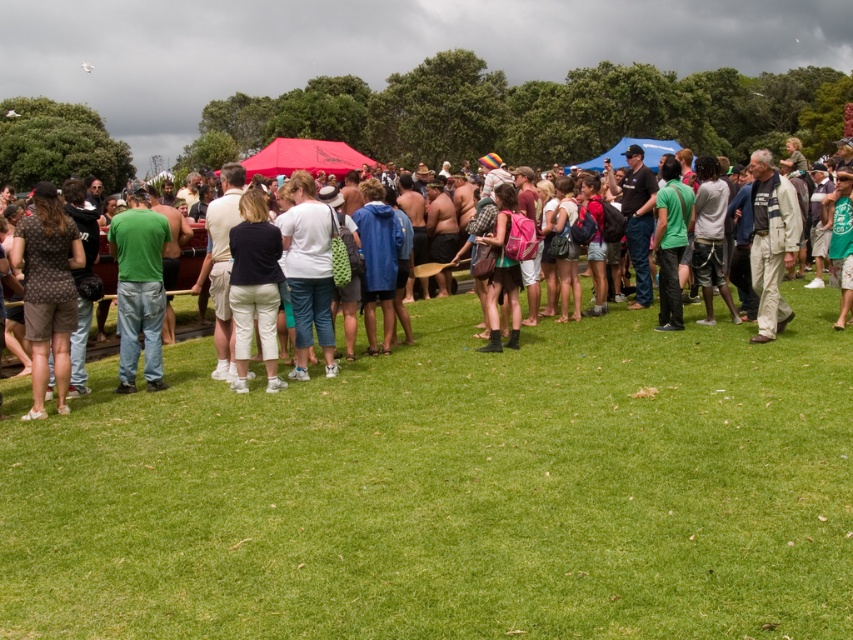
Does green matte shirt at center have a smaller size compared to dark blue fabric pants at center?

Incorrect, green matte shirt at center is not smaller in size than dark blue fabric pants at center.

Can you confirm if green matte shirt at center is shorter than dark blue fabric pants at center?

No, green matte shirt at center is not shorter than dark blue fabric pants at center.

Image resolution: width=853 pixels, height=640 pixels. What do you see at coordinates (138, 289) in the screenshot?
I see `green matte shirt at center` at bounding box center [138, 289].

Locate an element on the screen. The height and width of the screenshot is (640, 853). green matte shirt at center is located at coordinates (138, 289).

Which of these two, green grass at lower center or dark blue fabric pants at center, stands taller?

dark blue fabric pants at center

Is green grass at lower center positioned at the back of dark blue fabric pants at center?

No, green grass at lower center is closer to the viewer.

Who is more forward, [61,424] or [241,356]?

Positioned in front is point [61,424].

The height and width of the screenshot is (640, 853). I want to click on green grass at lower center, so click(x=450, y=490).

Is brown dotted shirt at left to the left of matte green shirt at center from the viewer's perspective?

Yes, brown dotted shirt at left is to the left of matte green shirt at center.

Between point (36, 228) and point (357, 240), which one is positioned behind?

Point (357, 240)

I want to click on brown dotted shirt at left, so click(48, 291).

I want to click on brown dotted shirt at left, so click(x=48, y=291).